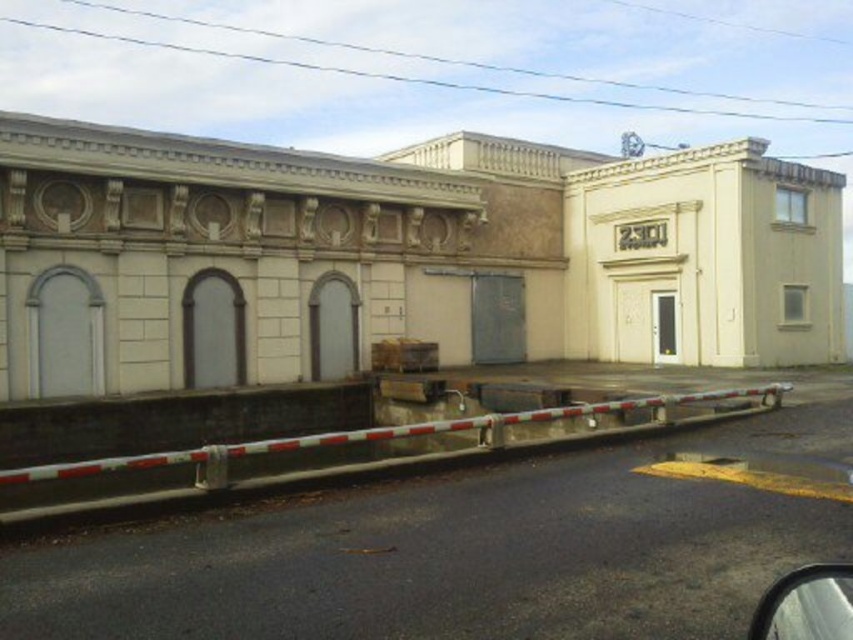
Question: Is white metallic barricade at lower center to the left of metallic silver mirror at lower right from the viewer's perspective?

Choices:
 (A) yes
 (B) no

Answer: (A)

Question: Which of the following is the farthest from the observer?

Choices:
 (A) metallic silver mirror at lower right
 (B) white metallic barricade at lower center

Answer: (B)

Question: Which object appears closest to the camera in this image?

Choices:
 (A) metallic silver mirror at lower right
 (B) white metallic barricade at lower center

Answer: (A)

Question: Does white metallic barricade at lower center have a lesser width compared to metallic silver mirror at lower right?

Choices:
 (A) yes
 (B) no

Answer: (B)

Question: Does white metallic barricade at lower center have a greater width compared to metallic silver mirror at lower right?

Choices:
 (A) yes
 (B) no

Answer: (A)